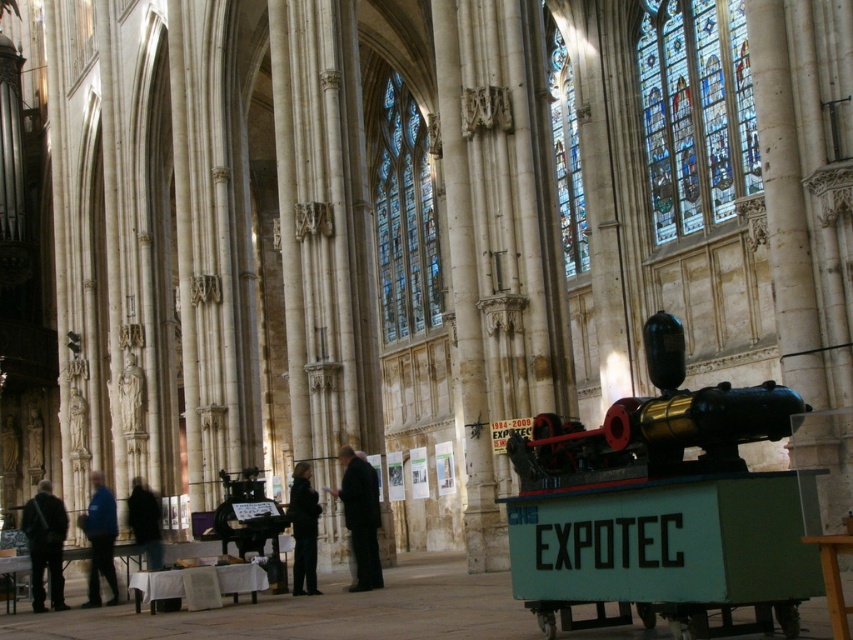
In the scene shown: You are standing in the cathedral and want to place a 60 feet long banner between the metallic gold train at center and the dark gray fabric coat at center. Is there enough space to do so without overlapping either object?

The metallic gold train at center and dark gray fabric coat at center are 58.40 feet apart from each other. Since the banner is 60 feet long, it would require more space than available, so it won not fit between them without overlapping.

You are an art student visiting the cathedral and want to sketch the scene. You notice the metallic gold train at center and the dark gray fabric coat at center. Which object should you draw first if you want to start with the one that is physically above the other?

The metallic gold train at center is positioned over the dark gray fabric coat at center, so you should draw the metallic gold train at center first since it is above the other object.